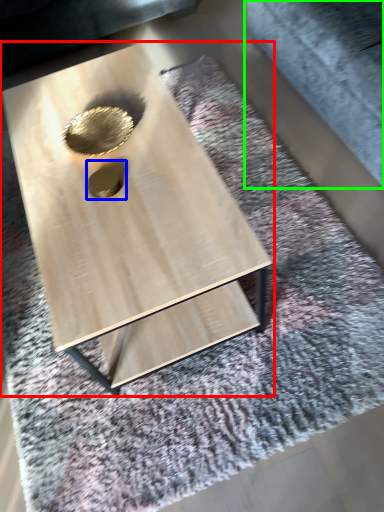
Question: Estimate the real-world distances between objects in this image. Which object is closer to coffee table (highlighted by a red box), hole (highlighted by a blue box) or gray (highlighted by a green box)?

Choices:
 (A) hole
 (B) gray

Answer: (A)